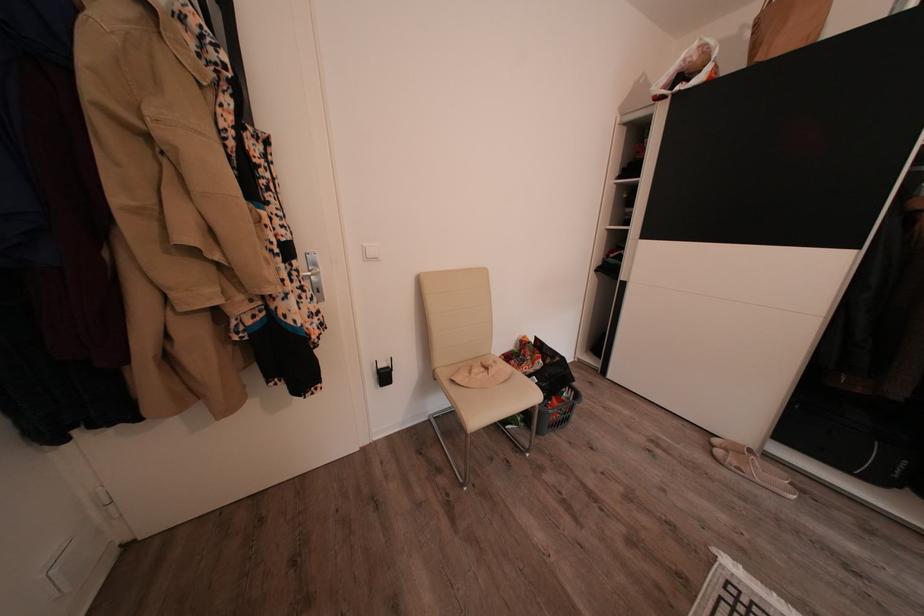
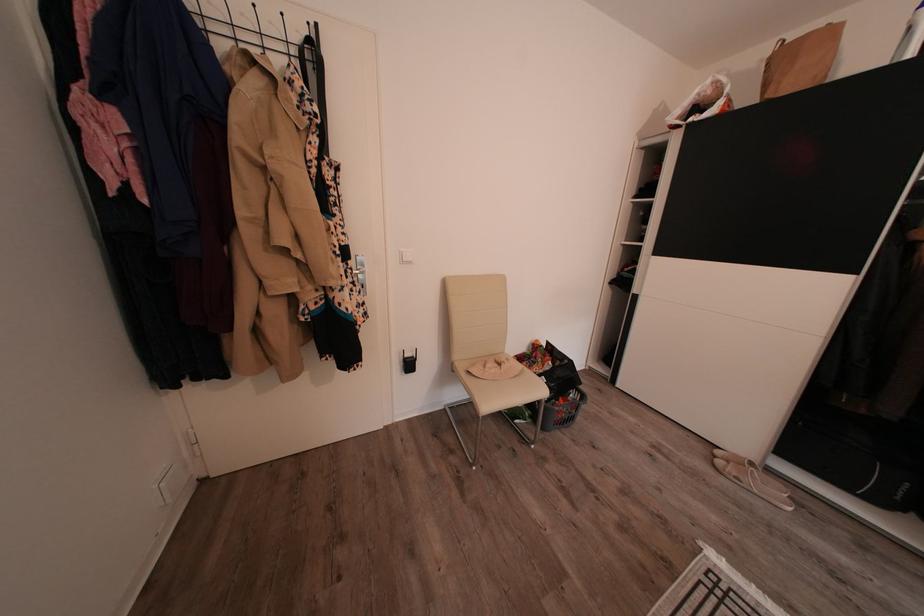
Locate, in the second image, the point that corresponds to (885,485) in the first image.

(888, 507)